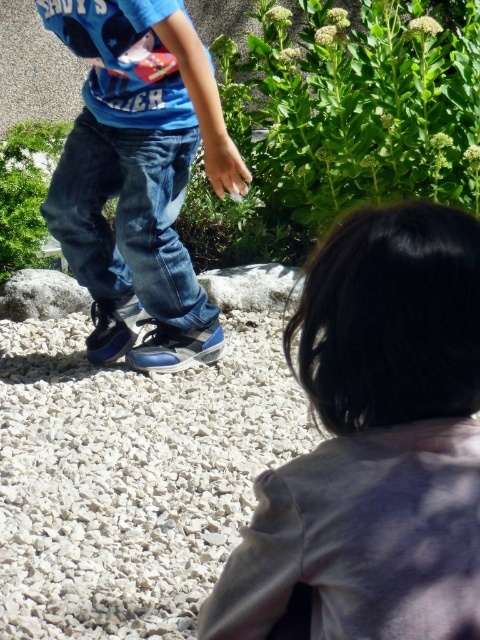
You are a landscape architect designing a garden pathway. You have two materials available for the path surface at the center of the scene. One is the white gravel at center, and the other is the denim jeans at center. Based on their sizes, which material would you choose for the pathway to ensure it is stable and durable?

The white gravel at center is larger in size than the denim jeans at center, so the white gravel at center would be more stable and durable for the pathway since larger particles provide better structural support.

You are a photographer standing at the center of the scene. You want to take a photo that includes both the smooth gray shirt at lower right and the denim jeans at center. Given that your camera has a maximum zoom range of 10 feet, will you be able to capture both objects in the same frame without moving closer?

The smooth gray shirt at lower right and denim jeans at center are 8.95 feet apart from each other, which is within the camera maximum zoom range of 10 feet. Therefore, you can capture both objects in the same frame without moving closer.

From the picture: You are standing at the point with coordinates point (187, 161) and want to move to the point with coordinates point (154, 554). Which direction should you move to get closer to the camera?

You should move towards point (154, 554) because it is closer to the camera than point (187, 161).